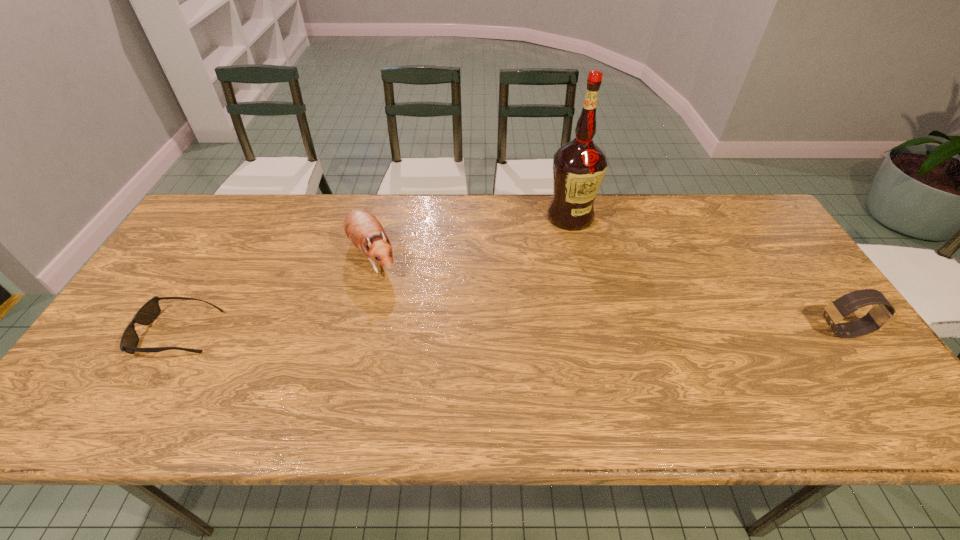
Where is `vacant space that's between the watch and the shortest object`? vacant space that's between the watch and the shortest object is located at coordinates (511, 332).

This screenshot has width=960, height=540. Find the location of `blank region between the tallest object and the rightmost object`. blank region between the tallest object and the rightmost object is located at coordinates (707, 274).

Identify the location of unoccupied area between the leftmost object and the rightmost object. (511, 332).

The image size is (960, 540). In order to click on vacant area that lies between the second object from left to right and the alcohol in this screenshot , I will do `click(471, 236)`.

Choose which object is the nearest neighbor to the sunglasses. Please provide its 2D coordinates. Your answer should be formatted as a tuple, i.e. [(x, y)], where the tuple contains the x and y coordinates of a point satisfying the conditions above.

[(362, 228)]

Identify which object is the third closest to the hamster. Please provide its 2D coordinates. Your answer should be formatted as a tuple, i.e. [(x, y)], where the tuple contains the x and y coordinates of a point satisfying the conditions above.

[(882, 314)]

The height and width of the screenshot is (540, 960). What are the coordinates of `free spot that satisfies the following two spatial constraints: 1. on the front side of the rightmost object; 2. on the face of the second object from left to right` in the screenshot? It's located at (353, 330).